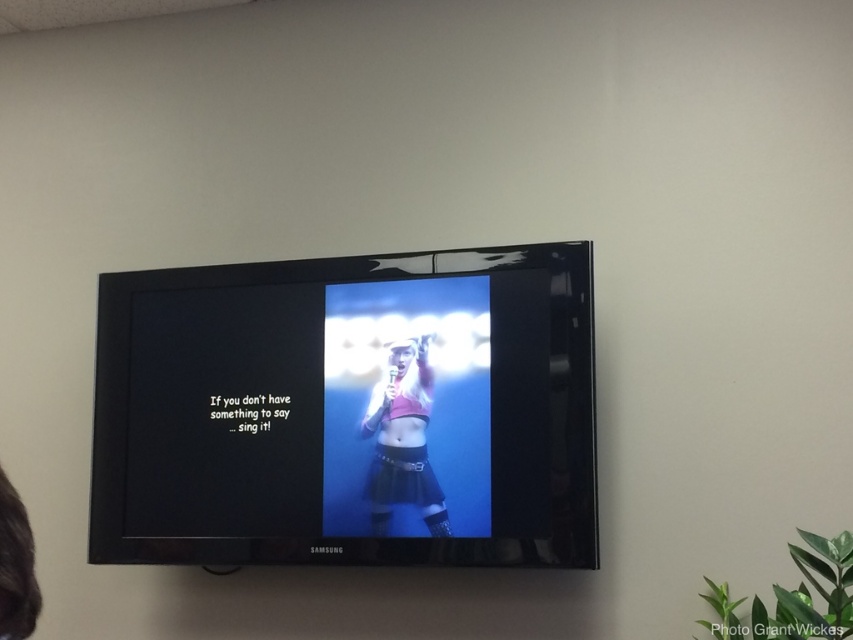
Is matte black tv at center closer to the viewer compared to matte pink top at center?

Yes, it is in front of matte pink top at center.

Who is more distant from viewer, (271, 339) or (432, 380)?

Point (271, 339)

Is point (582, 353) positioned in front of point (427, 422)?

Yes, it is.

Image resolution: width=853 pixels, height=640 pixels. Identify the location of matte black tv at center. 347,410.